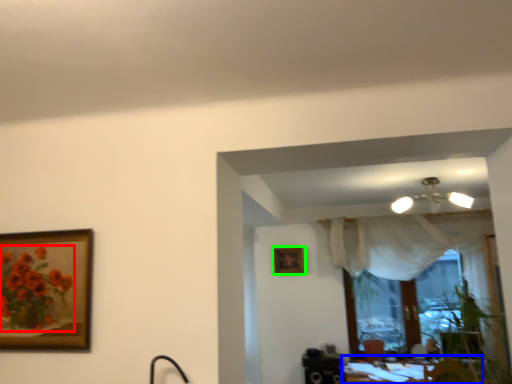
Question: Which object is positioned farthest from flower (highlighted by a red box)? Select from table (highlighted by a blue box) and picture frame (highlighted by a green box).

Choices:
 (A) table
 (B) picture frame

Answer: (A)